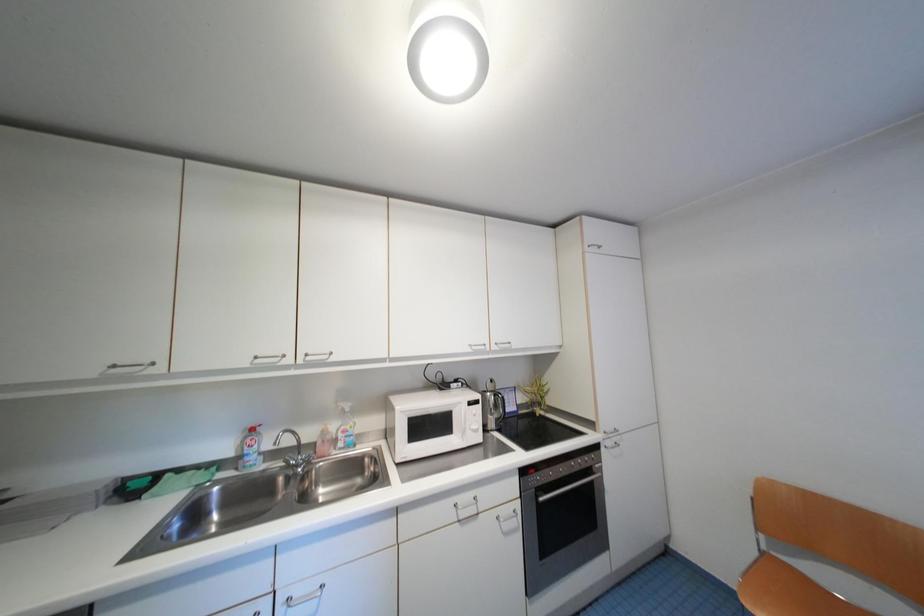
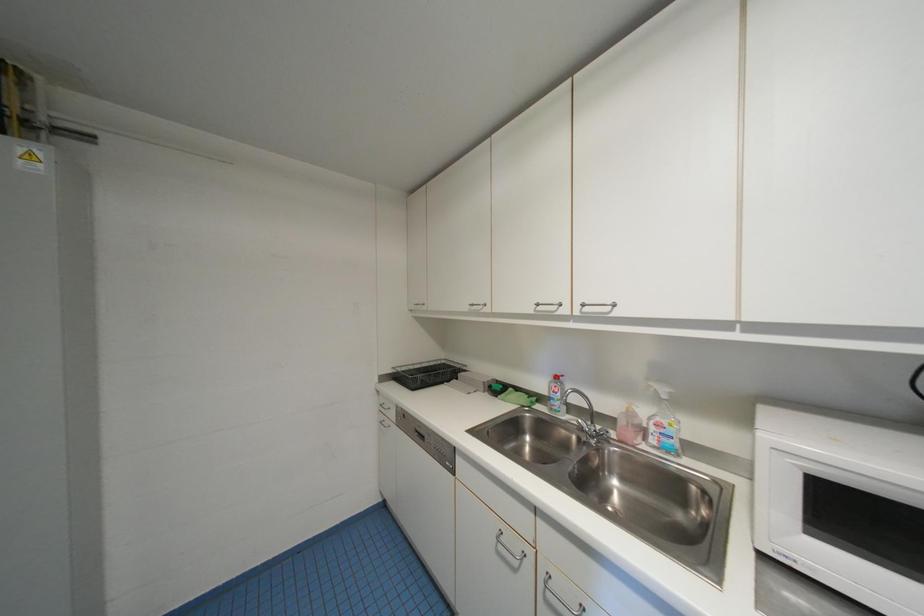
Question: The first image is from the beginning of the video and the second image is from the end. How did the camera likely rotate when shooting the video?

Choices:
 (A) Left
 (B) Right
 (C) Up
 (D) Down

Answer: (A)